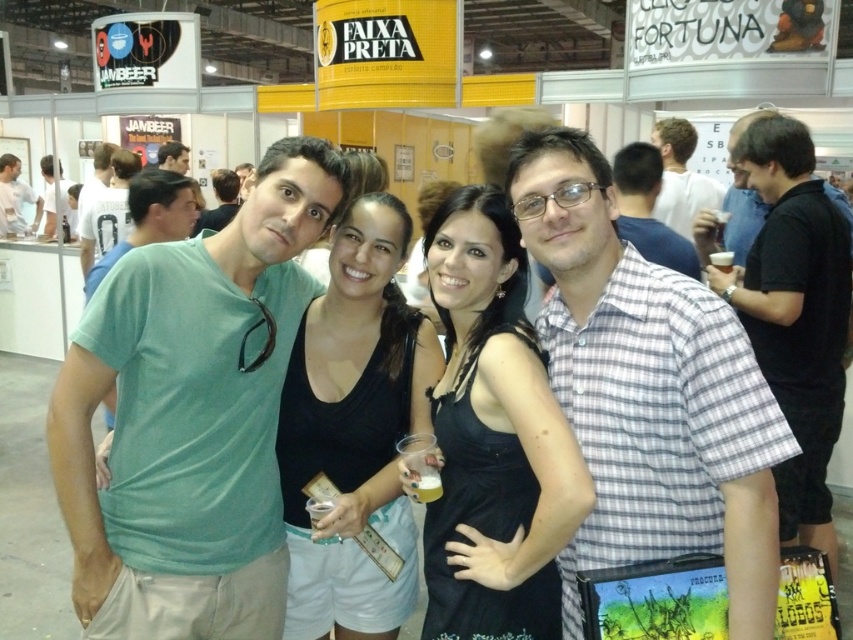
Which is in front, point (113, 604) or point (22, 192)?

Point (113, 604) is in front.

Is green cotton t-shirt at center to the right of white matte shirt at left from the viewer's perspective?

Indeed, green cotton t-shirt at center is positioned on the right side of white matte shirt at left.

Which is behind, point (230, 632) or point (19, 200)?

Point (19, 200)

The height and width of the screenshot is (640, 853). Identify the location of green cotton t-shirt at center. (192, 416).

The width and height of the screenshot is (853, 640). In order to click on black plaid shirt at center in this screenshot , I will do `click(795, 316)`.

Does black plaid shirt at center have a greater height compared to light brown hair at upper right?

Correct, black plaid shirt at center is much taller as light brown hair at upper right.

Is point (801, 509) positioned in front of point (717, 186)?

Yes, point (801, 509) is in front of point (717, 186).

I want to click on black plaid shirt at center, so 795,316.

Consider the image. Who is taller, checkered fabric shirt at center or matte green t-shirt at upper left?

Standing taller between the two is checkered fabric shirt at center.

Does checkered fabric shirt at center have a greater height compared to matte green t-shirt at upper left?

Yes.

Does point (642, 525) lie in front of point (183, 154)?

Yes, point (642, 525) is in front of point (183, 154).

Where is `checkered fabric shirt at center`? checkered fabric shirt at center is located at coordinates (648, 392).